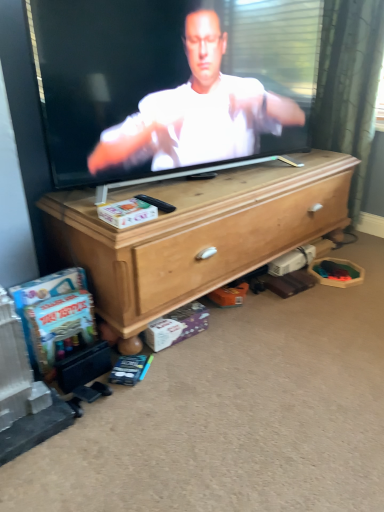
Question: From the image's perspective, relative to black plastic remote control at center, is wooden chest of drawers at center above or below?

Choices:
 (A) below
 (B) above

Answer: (A)

Question: In terms of width, does wooden chest of drawers at center look wider or thinner when compared to black plastic remote control at center?

Choices:
 (A) thin
 (B) wide

Answer: (B)

Question: Which object is the closest to the wooden chest of drawers at center?

Choices:
 (A) black plastic remote control at center
 (B) smooth white shirt at center

Answer: (B)

Question: Estimate the real-world distances between objects in this image. Which object is closer to the wooden chest of drawers at center?

Choices:
 (A) black plastic remote control at center
 (B) smooth white shirt at center

Answer: (B)